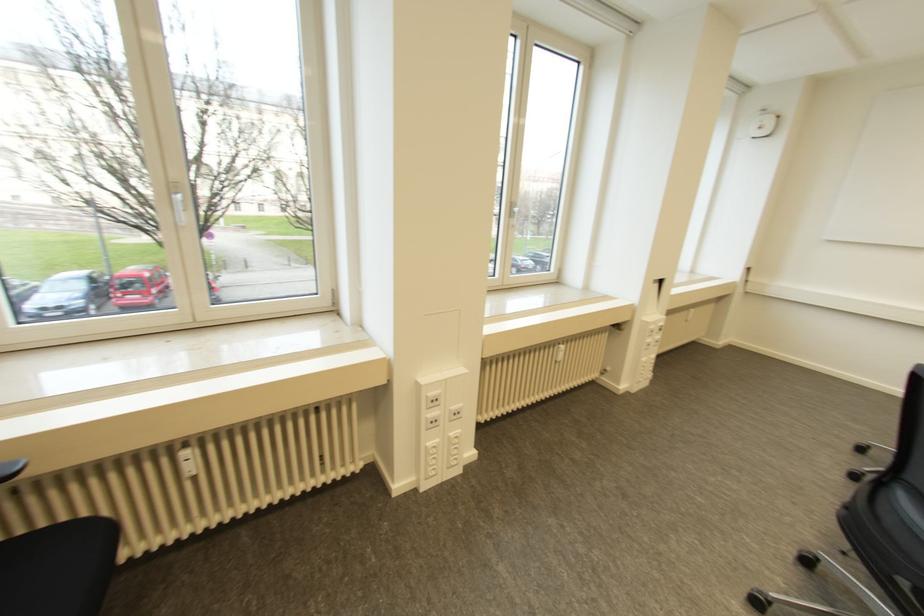
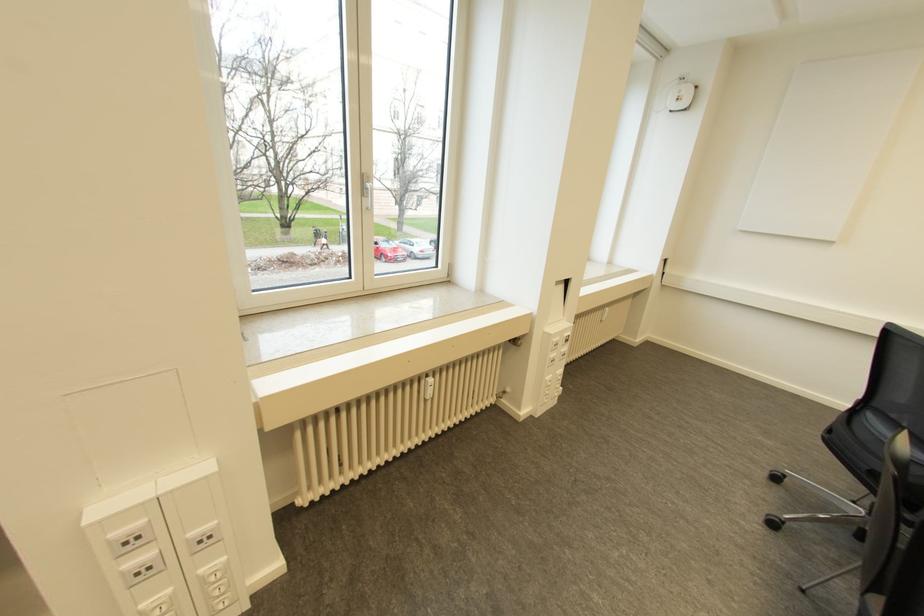
Question: The first image is from the beginning of the video and the second image is from the end. How did the camera likely rotate when shooting the video?

Choices:
 (A) Left
 (B) Right
 (C) Up
 (D) Down

Answer: (B)